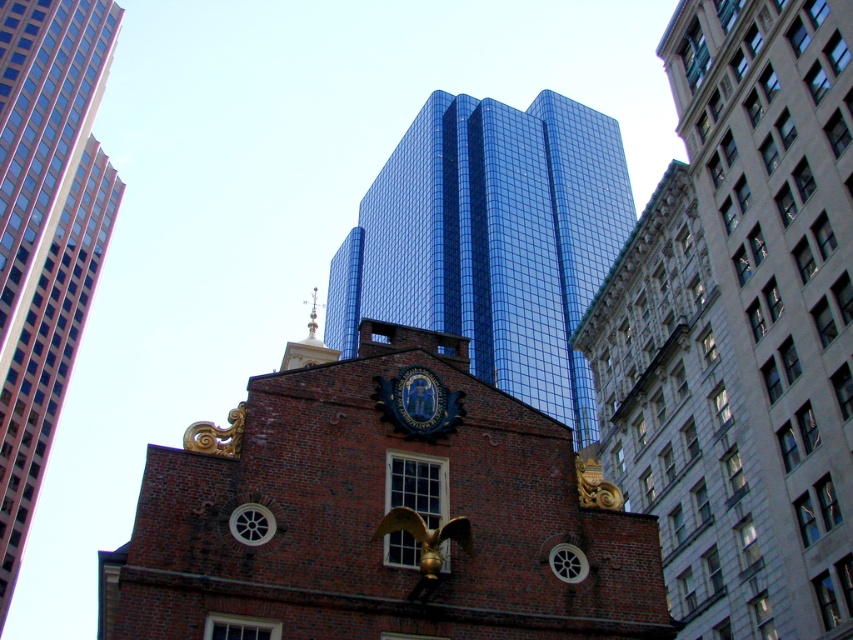
In the scene shown: You are a city planner who needs to install a new streetlight between the glossy glass tower at center and the brick bell tower at center. The streetlight requires a minimum of 200 feet of space between the two towers to be safely installed. Based on the provided information, can the streetlight be placed between them?

The glossy glass tower at center and brick bell tower at center are 209.39 feet apart, which exceeds the minimum required 200 feet. Therefore, the streetlight can be safely installed between them.

You are an architect analyzing the image. You need to determine if the brown brick building at center can fit within the space allocated for the blue glossy seal at center. Based on their widths, what do you conclude?

The brown brick building at center is wider than the blue glossy seal at center, so it cannot fit within the space allocated for the blue glossy seal at center.

Based on the photo, you are an architect analyzing the central elements of the building. Which object, the brick bell tower at center or the blue glossy seal at center, occupies more visual space in the image?

The brick bell tower at center is larger in size than the blue glossy seal at center, so it occupies more visual space.